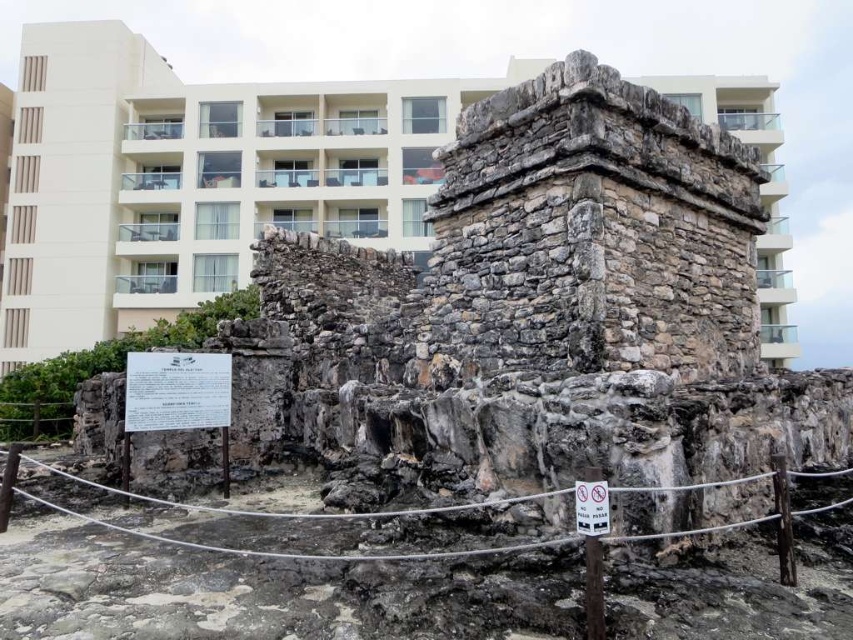
Question: Which object is the farthest from the beige concrete building at upper center?

Choices:
 (A) white paper sign at center
 (B) white plastic sign at center

Answer: (B)

Question: Which point appears closest to the camera in this image?

Choices:
 (A) (x=199, y=388)
 (B) (x=119, y=72)
 (C) (x=604, y=490)

Answer: (C)

Question: Can you confirm if white paper sign at center is positioned below white plastic sign at center?

Choices:
 (A) no
 (B) yes

Answer: (A)

Question: Observing the image, what is the correct spatial positioning of beige concrete building at upper center in reference to white plastic sign at center?

Choices:
 (A) right
 (B) left

Answer: (B)

Question: Which of the following is the farthest from the observer?

Choices:
 (A) white plastic sign at center
 (B) white paper sign at center

Answer: (B)

Question: Does beige concrete building at upper center appear on the right side of white plastic sign at center?

Choices:
 (A) no
 (B) yes

Answer: (A)